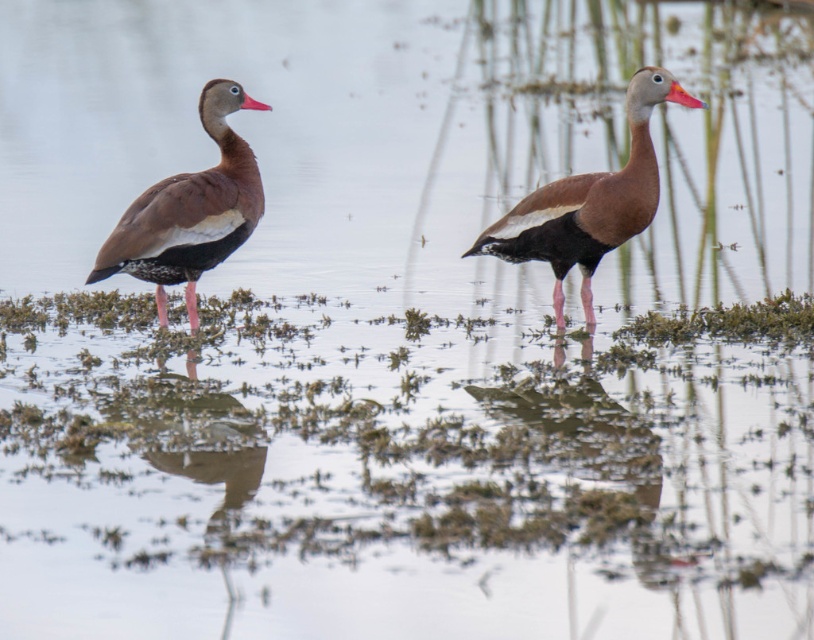
You are a photographer trying to capture a photo of both ducks. You are standing behind the brown matte duck at left and the brown matte duck at right. Which duck is closer to your position?

The brown matte duck at left is closer to your position since it is positioned to the left of the brown matte duck at right, meaning it is nearer to the photographer standing behind them.

You are a wildlife photographer observing two brown matte ducks in a marsh. You notice their reflections in the water. Which duck has a more slender silhouette when comparing the brown matte duck at left and the brown matte duck at right?

The brown matte duck at left is thinner than the brown matte duck at right, so its silhouette appears more slender in the reflection.

You are a wildlife photographer observing two brown matte ducks in a marsh. You notice their reflections in the water. Which duck, the brown matte duck at left or the brown matte duck at right, appears taller in the reflection?

The brown matte duck at right appears taller in the reflection because the brown matte duck at left is not as tall as the brown matte duck at right.